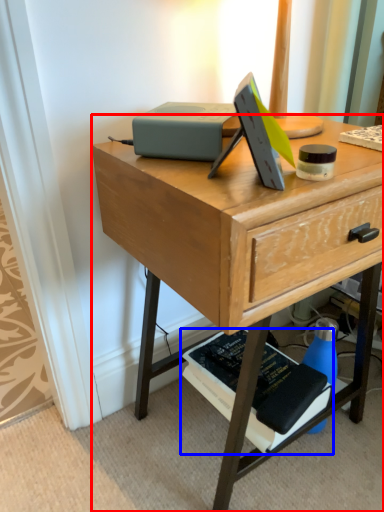
Question: Which object appears closest to the camera in this image, desk (highlighted by a red box) or paperback book (highlighted by a blue box)?

Choices:
 (A) desk
 (B) paperback book

Answer: (A)